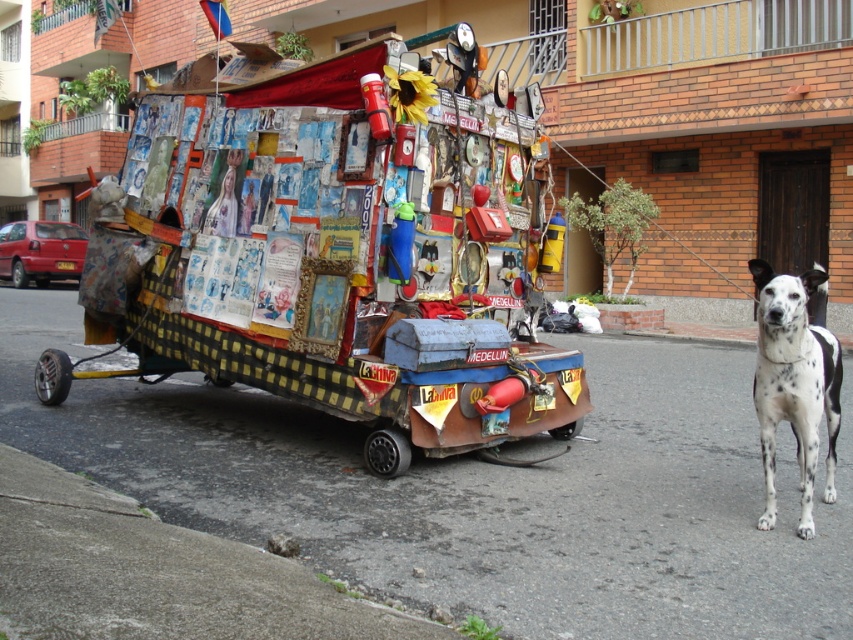
You are standing in front of the decorative cardboard cart at center. There is a point at coordinates (332, 260). Where is this point located?

The point at coordinates (332, 260) is located on the decorative cardboard cart at center.